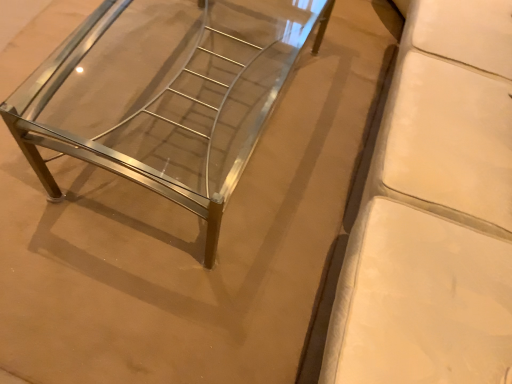
Question: Considering the relative sizes of white leather couch at right, the first furniture when ordered from right to left, and polished chrome bench at center, which is the second furniture from right to left, in the image provided, is white leather couch at right, the first furniture when ordered from right to left, wider than polished chrome bench at center, which is the second furniture from right to left,?

Choices:
 (A) no
 (B) yes

Answer: (B)

Question: From the image's perspective, is white leather couch at right, the first furniture when ordered from right to left, on polished chrome bench at center, which is the second furniture from right to left?

Choices:
 (A) yes
 (B) no

Answer: (B)

Question: Is white leather couch at right, the first furniture when ordered from right to left, further to camera compared to polished chrome bench at center, positioned as the first furniture in left-to-right order?

Choices:
 (A) no
 (B) yes

Answer: (A)

Question: Is white leather couch at right, acting as the 2th furniture starting from the left, closer to the viewer compared to polished chrome bench at center, positioned as the first furniture in left-to-right order?

Choices:
 (A) yes
 (B) no

Answer: (A)

Question: Would you consider white leather couch at right, acting as the 2th furniture starting from the left, to be distant from polished chrome bench at center, positioned as the first furniture in left-to-right order?

Choices:
 (A) yes
 (B) no

Answer: (B)

Question: From a real-world perspective, is white leather couch at right, the first furniture when ordered from right to left, located beneath polished chrome bench at center, which is the second furniture from right to left?

Choices:
 (A) no
 (B) yes

Answer: (A)

Question: Can we say polished chrome bench at center, which is the second furniture from right to left, lies outside white leather couch at right, acting as the 2th furniture starting from the left?

Choices:
 (A) yes
 (B) no

Answer: (A)

Question: From a real-world perspective, is polished chrome bench at center, which is the second furniture from right to left, located beneath white leather couch at right, acting as the 2th furniture starting from the left?

Choices:
 (A) no
 (B) yes

Answer: (B)

Question: Is the depth of polished chrome bench at center, positioned as the first furniture in left-to-right order, less than that of white leather couch at right, the first furniture when ordered from right to left?

Choices:
 (A) no
 (B) yes

Answer: (A)

Question: Is polished chrome bench at center, which is the second furniture from right to left, facing towards white leather couch at right, the first furniture when ordered from right to left?

Choices:
 (A) yes
 (B) no

Answer: (B)

Question: From the image's perspective, is polished chrome bench at center, which is the second furniture from right to left, below white leather couch at right, the first furniture when ordered from right to left?

Choices:
 (A) yes
 (B) no

Answer: (B)

Question: Considering the relative sizes of polished chrome bench at center, which is the second furniture from right to left, and white leather couch at right, the first furniture when ordered from right to left, in the image provided, is polished chrome bench at center, which is the second furniture from right to left, taller than white leather couch at right, the first furniture when ordered from right to left,?

Choices:
 (A) yes
 (B) no

Answer: (B)

Question: From a real-world perspective, is polished chrome bench at center, which is the second furniture from right to left, physically located above or below white leather couch at right, acting as the 2th furniture starting from the left?

Choices:
 (A) below
 (B) above

Answer: (A)